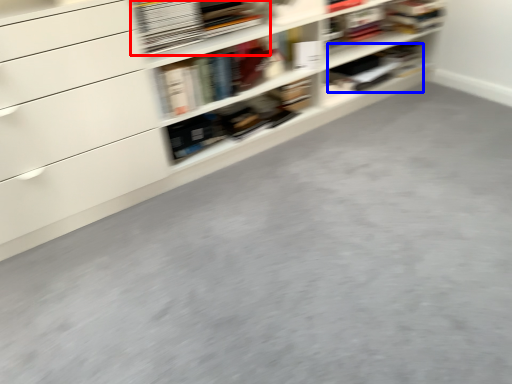
Question: Which point is further to the camera, book (highlighted by a red box) or book (highlighted by a blue box)?

Choices:
 (A) book
 (B) book

Answer: (B)